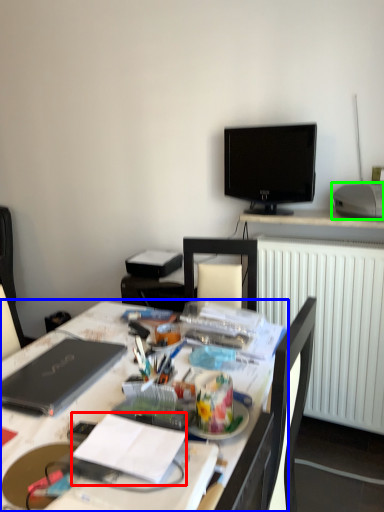
Question: Estimate the real-world distances between objects in this image. Which object is farther from notebook (highlighted by a red box), desk (highlighted by a blue box) or printer (highlighted by a green box)?

Choices:
 (A) desk
 (B) printer

Answer: (B)